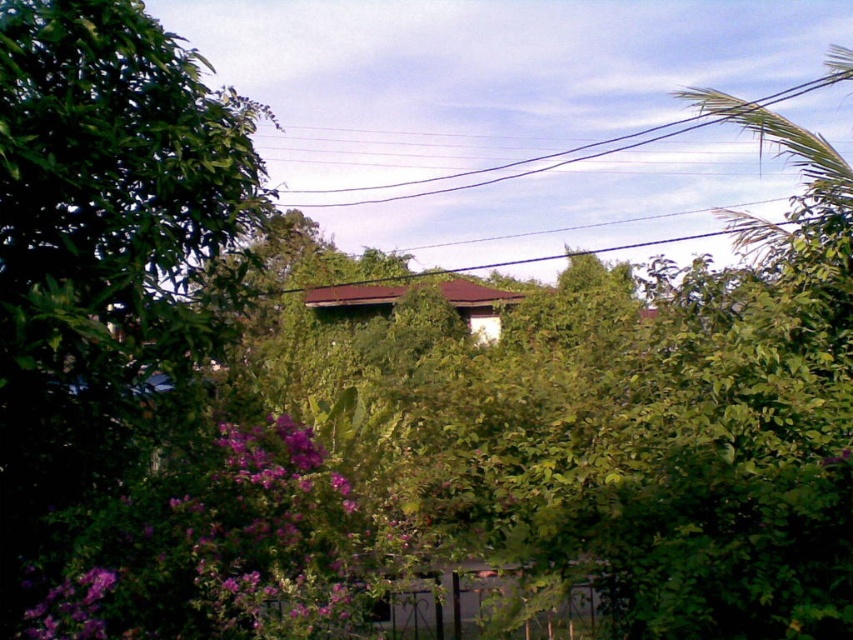
You are a gardener planning to install a new plant support system. You see the black wire at upper center and the purple matte flower at lower left. Which object is wider in terms of physical dimensions?

The black wire at upper center is wider than the purple matte flower at lower left according to the description.

You are a gardener planning to install a new light fixture. You see the black wire at upper center and the purple matte flower at lower left. Which object is positioned higher in the scene?

The black wire at upper center is located above the purple matte flower at lower left, so it is positioned higher in the scene.